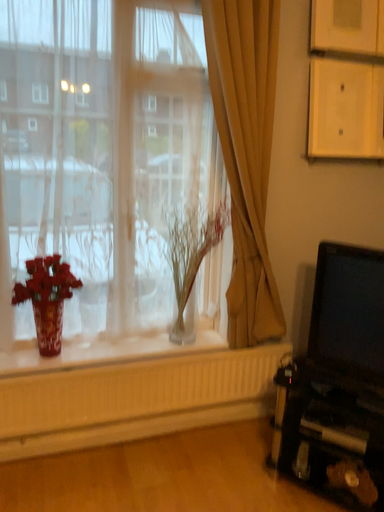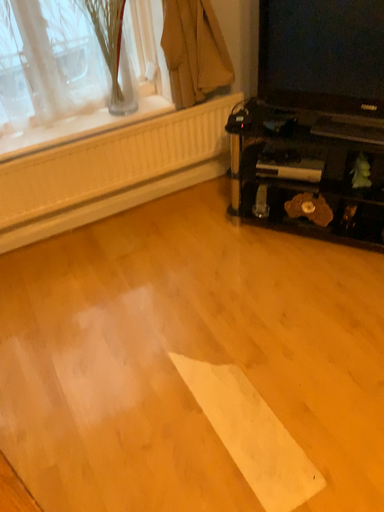
Question: How did the camera likely rotate when shooting the video?

Choices:
 (A) rotated downward
 (B) rotated upward

Answer: (A)